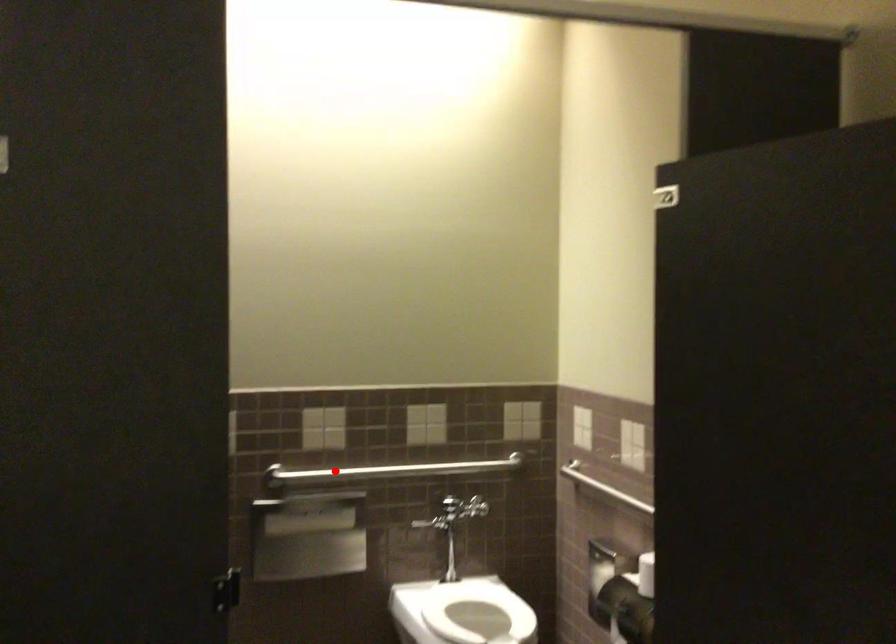
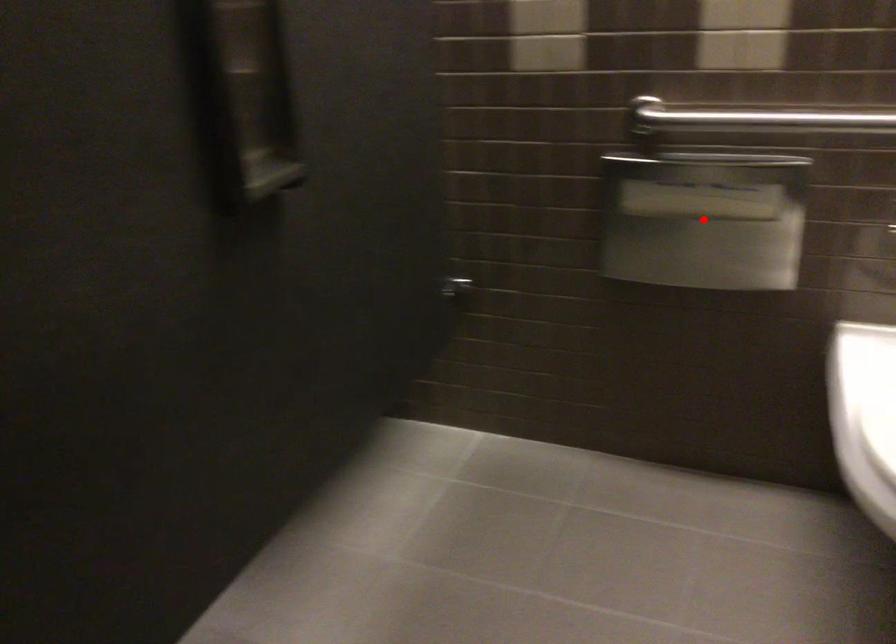
I am providing you with two images of the same scene from different viewpoints. A red point is marked on the first image and another point is marked on the second image. Is the red point in image1 aligned with the point shown in image2?

No